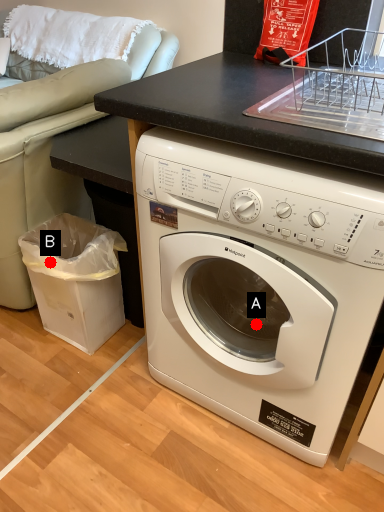
Question: Two points are circled on the image, labeled by A and B beside each circle. Which point is further to the camera?

Choices:
 (A) A is further
 (B) B is further

Answer: (B)